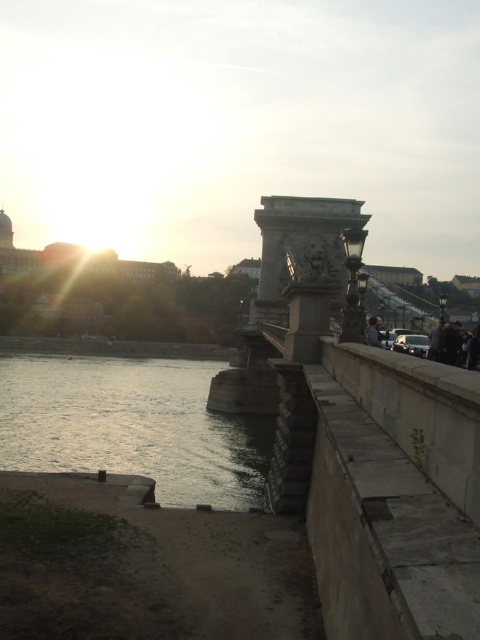
Question: Does silvery reflective water at lower left come in front of dark gray fabric jacket at right?

Choices:
 (A) no
 (B) yes

Answer: (A)

Question: Does silvery reflective water at lower left appear over dark gray fabric jacket at right?

Choices:
 (A) yes
 (B) no

Answer: (B)

Question: Among these objects, which one is nearest to the camera?

Choices:
 (A) silvery reflective water at lower left
 (B) dark gray fabric jacket at right

Answer: (B)

Question: Is silvery reflective water at lower left bigger than dark gray fabric jacket at right?

Choices:
 (A) no
 (B) yes

Answer: (B)

Question: Which of the following is the farthest from the observer?

Choices:
 (A) (367, 324)
 (B) (226, 472)

Answer: (B)